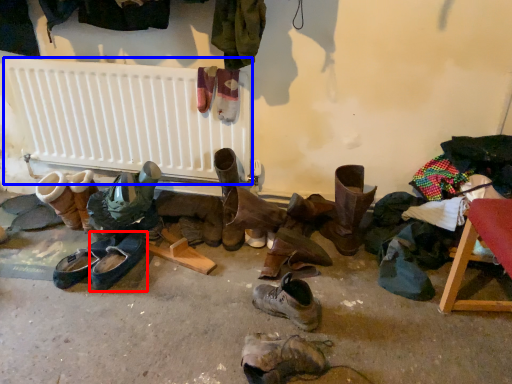
Question: Which point is further to the camera, footwear (highlighted by a red box) or radiator (highlighted by a blue box)?

Choices:
 (A) footwear
 (B) radiator

Answer: (B)